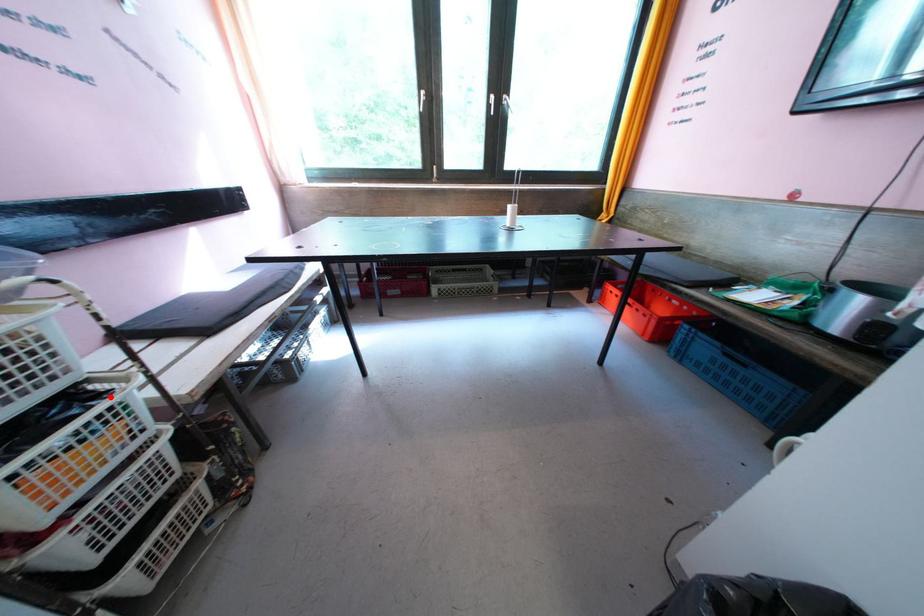
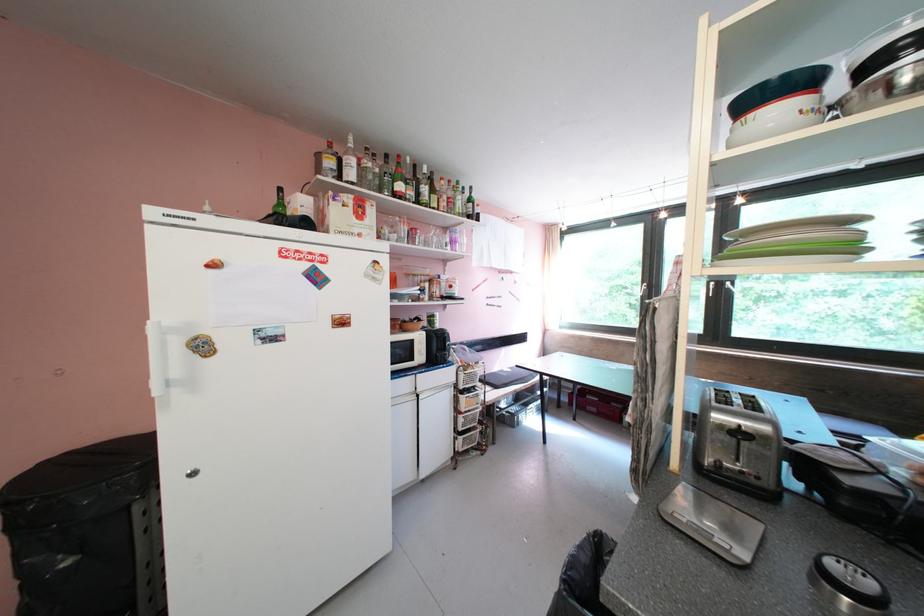
Question: I am providing you with two images of the same scene from different viewpoints. In image1, a red point is highlighted. Considering the same 3D point in image2, which of the following is correct?

Choices:
 (A) It is closer
 (B) It is farther

Answer: (B)